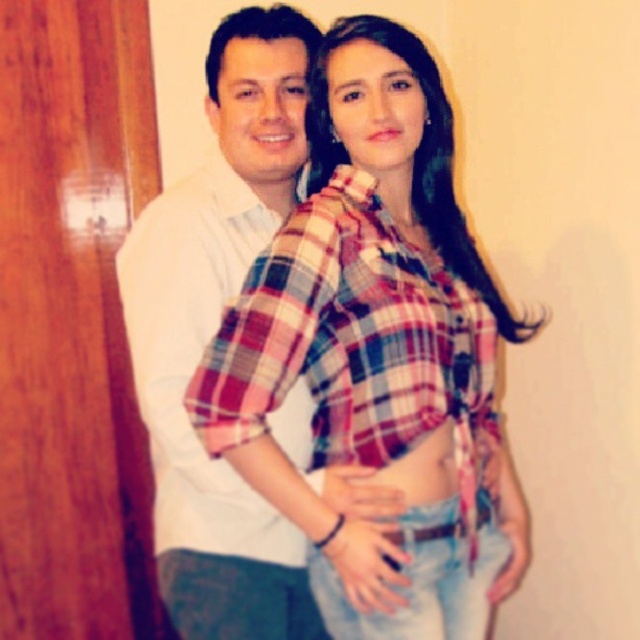
Question: Is plaid fabric shirt at center above smooth fabric belly at center?

Choices:
 (A) yes
 (B) no

Answer: (A)

Question: Is the position of plaid cotton shirt at center more distant than that of smooth fabric belly at center?

Choices:
 (A) yes
 (B) no

Answer: (B)

Question: Can you confirm if plaid cotton shirt at center is positioned below smooth fabric belly at center?

Choices:
 (A) yes
 (B) no

Answer: (B)

Question: Based on their relative distances, which object is nearer to the smooth fabric belly at center?

Choices:
 (A) plaid fabric shirt at center
 (B) plaid cotton shirt at center

Answer: (A)

Question: Which object appears closest to the camera in this image?

Choices:
 (A) plaid cotton shirt at center
 (B) plaid fabric shirt at center

Answer: (B)

Question: Which object appears farthest from the camera in this image?

Choices:
 (A) smooth fabric belly at center
 (B) plaid fabric shirt at center
 (C) plaid cotton shirt at center

Answer: (A)